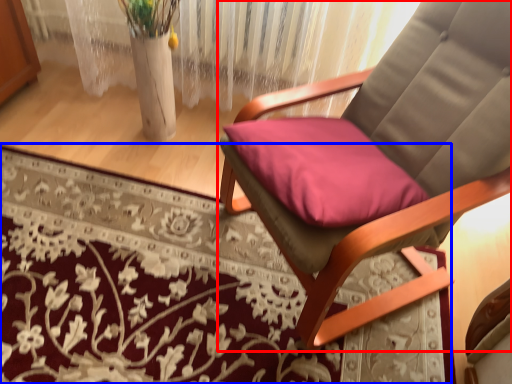
Question: Which object is further to the camera taking this photo, chair (highlighted by a red box) or mat (highlighted by a blue box)?

Choices:
 (A) chair
 (B) mat

Answer: (B)